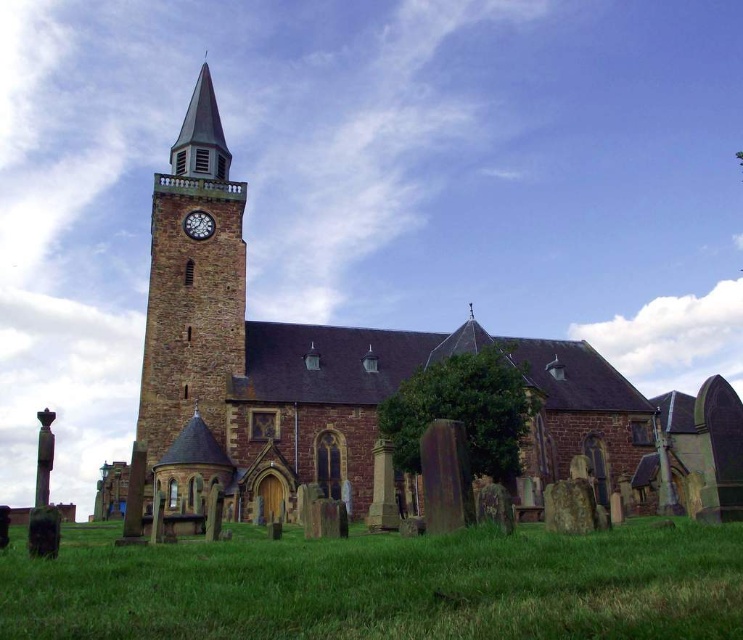
You are standing in front of the historic stone church with the clock tower. You notice two points marked in the image. The first point is at coordinates point (718,435) and the second point is at point (204,212). Which of these two points is closer to you?

Point (718,435) is closer to the viewer than point (204,212).

You are a landscape architect planning to add a new garden feature. The brown stone church at center and the green grass at lower center are both in your view. Which object is bigger in size?

The brown stone church at center has a larger size compared to the green grass at lower center, so the brown stone church at center is bigger.

You are standing in front of the historic stone church and want to place a small garden statue. You have two options for placement based on the image you see. The first option is on the green grass at lower center, and the second is near the white clock face at upper left. Which location would allow the statue to be more visible to someone approaching the church from the front?

The white clock face at upper left is lower than the green grass at lower center, so placing the statue near the white clock face at upper left would make it more visible to someone approaching the church from the front because it is at a higher elevation.